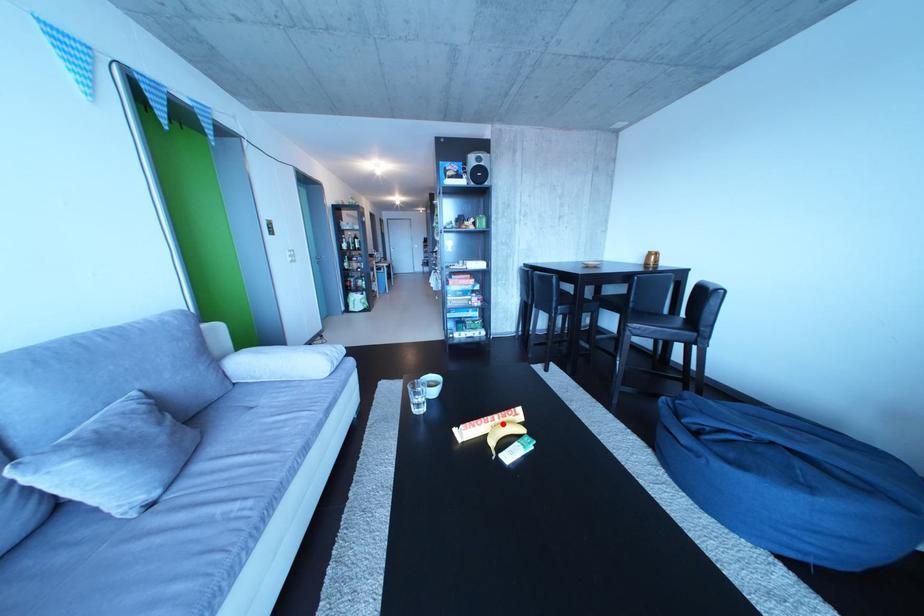
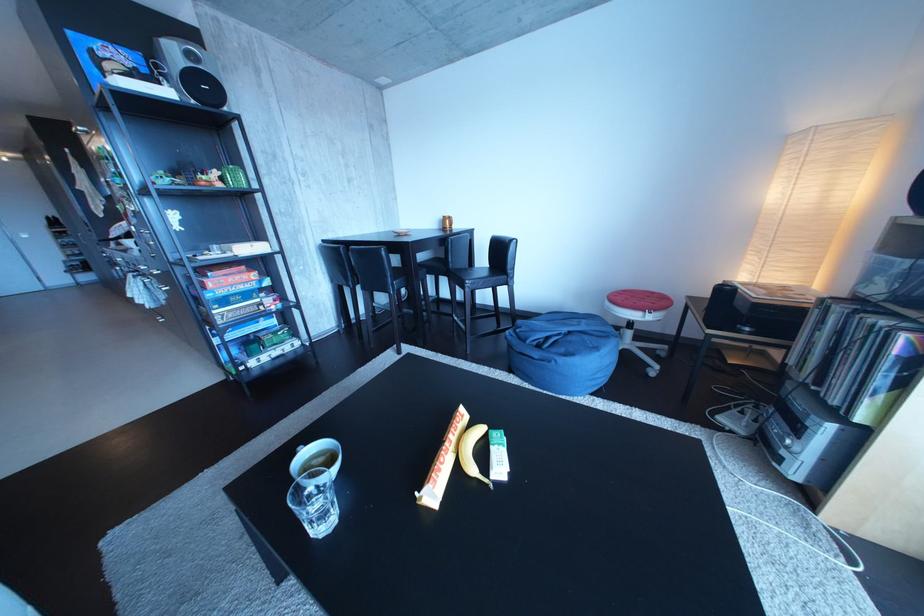
Question: I am providing you with two images of the same scene from different viewpoints. A red point is marked on the first image. Is the red point's position out of view in image 2?

Choices:
 (A) Yes
 (B) No

Answer: (B)